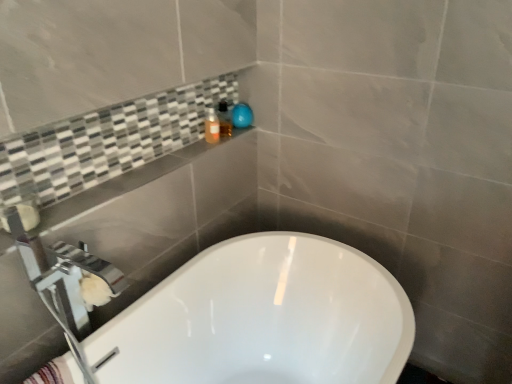
Where is `silver metallic faucet at lower left`? silver metallic faucet at lower left is located at coordinates (76, 283).

Describe the element at coordinates (64, 283) in the screenshot. The image size is (512, 384). I see `chrome metallic tap at upper left` at that location.

You are a GUI agent. You are given a task and a screenshot of the screen. Output one action in this format:
    pyautogui.click(x=<x>, y=<y>)
    Task: Click on the matte orange bottle at upper center, which is counted as the 2th toiletry, starting from the right
    The image size is (512, 384).
    Given the screenshot: What is the action you would take?
    pyautogui.click(x=212, y=126)

What do you see at coordinates (224, 119) in the screenshot?
I see `translucent plastic soap dispenser at upper center, the first toiletry positioned from the right` at bounding box center [224, 119].

Image resolution: width=512 pixels, height=384 pixels. Identify the location of striped cotton bath towel at lower left. (52, 373).

From a real-world perspective, which is physically below, chrome metallic tap at upper left or silver metallic faucet at lower left?

chrome metallic tap at upper left, from a real-world perspective.

Is chrome metallic tap at upper left facing away from silver metallic faucet at lower left?

No, chrome metallic tap at upper left is not facing away from silver metallic faucet at lower left.

Where is `bath towel that appears below the matte orange bottle at upper center, which is counted as the 2th toiletry, starting from the right (from a real-world perspective)`? bath towel that appears below the matte orange bottle at upper center, which is counted as the 2th toiletry, starting from the right (from a real-world perspective) is located at coordinates (52, 373).

Are matte orange bottle at upper center, which is counted as the 2th toiletry, starting from the right, and striped cotton bath towel at lower left located far from each other?

No, matte orange bottle at upper center, which is counted as the 2th toiletry, starting from the right, is not far from striped cotton bath towel at lower left.

Between matte orange bottle at upper center, which is counted as the 2th toiletry, starting from the right, and striped cotton bath towel at lower left, which one appears on the right side from the viewer's perspective?

Positioned to the right is matte orange bottle at upper center, which is counted as the 2th toiletry, starting from the right.

Considering the points (79, 287) and (48, 368), which point is in front, point (79, 287) or point (48, 368)?

Positioned in front is point (79, 287).

From the image's perspective, which object appears higher, chrome metallic tap at upper left or striped cotton bath towel at lower left?

chrome metallic tap at upper left.

Considering the relative positions of chrome metallic tap at upper left and striped cotton bath towel at lower left in the image provided, is chrome metallic tap at upper left behind striped cotton bath towel at lower left?

No.

How different are the orientations of chrome metallic tap at upper left and striped cotton bath towel at lower left in degrees?

0.00513 degrees.

Which is less distant, (97, 266) or (72, 330)?

The point (72, 330) is closer to the camera.

Is silver metallic faucet at lower left taller or shorter than chrome metallic tap at upper left?

In the image, silver metallic faucet at lower left appears to be shorter than chrome metallic tap at upper left.

Which is correct: silver metallic faucet at lower left is inside chrome metallic tap at upper left, or outside of it?

silver metallic faucet at lower left is spatially positioned inside chrome metallic tap at upper left.

From a real-world perspective, which is physically above, translucent plastic soap dispenser at upper center, the first toiletry positioned from the right, or white glossy bathtub at center?

In real-world perspective, translucent plastic soap dispenser at upper center, the first toiletry positioned from the right, is above.

In the scene shown: Is translucent plastic soap dispenser at upper center, marked as the second toiletry in a left-to-right arrangement, oriented away from white glossy bathtub at center?

translucent plastic soap dispenser at upper center, marked as the second toiletry in a left-to-right arrangement, does not have its back to white glossy bathtub at center.

Which is closer to the camera, [227,109] or [143,336]?

Point [143,336]

Does translucent plastic soap dispenser at upper center, marked as the second toiletry in a left-to-right arrangement, lie behind white glossy bathtub at center?

Yes, translucent plastic soap dispenser at upper center, marked as the second toiletry in a left-to-right arrangement, is behind white glossy bathtub at center.

Which object is closer to the camera, translucent plastic soap dispenser at upper center, the first toiletry positioned from the right, or chrome metallic tap at upper left?

chrome metallic tap at upper left is closer to the camera.

In terms of height, does translucent plastic soap dispenser at upper center, marked as the second toiletry in a left-to-right arrangement, look taller or shorter compared to chrome metallic tap at upper left?

In the image, translucent plastic soap dispenser at upper center, marked as the second toiletry in a left-to-right arrangement, appears to be shorter than chrome metallic tap at upper left.

Which is in front, point (223, 125) or point (97, 265)?

The point (97, 265) is closer.

From a real-world perspective, is translucent plastic soap dispenser at upper center, marked as the second toiletry in a left-to-right arrangement, below chrome metallic tap at upper left?

Incorrect, from a real-world perspective, translucent plastic soap dispenser at upper center, marked as the second toiletry in a left-to-right arrangement, is higher than chrome metallic tap at upper left.

Is translucent plastic soap dispenser at upper center, the first toiletry positioned from the right, to the right of striped cotton bath towel at lower left from the viewer's perspective?

Indeed, translucent plastic soap dispenser at upper center, the first toiletry positioned from the right, is positioned on the right side of striped cotton bath towel at lower left.

Is translucent plastic soap dispenser at upper center, the first toiletry positioned from the right, shorter than striped cotton bath towel at lower left?

Yes, translucent plastic soap dispenser at upper center, the first toiletry positioned from the right, is shorter than striped cotton bath towel at lower left.

From a real-world perspective, who is located higher, translucent plastic soap dispenser at upper center, marked as the second toiletry in a left-to-right arrangement, or striped cotton bath towel at lower left?

translucent plastic soap dispenser at upper center, marked as the second toiletry in a left-to-right arrangement.

Looking at this image, does translucent plastic soap dispenser at upper center, the first toiletry positioned from the right, turn towards striped cotton bath towel at lower left?

No, translucent plastic soap dispenser at upper center, the first toiletry positioned from the right, is not facing towards striped cotton bath towel at lower left.

Image resolution: width=512 pixels, height=384 pixels. I want to click on tap lying on the right of silver metallic faucet at lower left, so click(x=64, y=283).

From a real-world perspective, count 1st toiletrys upward from the striped cotton bath towel at lower left and point to it. Please provide its 2D coordinates.

[(212, 126)]

Estimate the real-world distances between objects in this image. Which object is closer to white glossy bathtub at center, silver metallic faucet at lower left or translucent plastic soap dispenser at upper center, the first toiletry positioned from the right?

silver metallic faucet at lower left lies closer to white glossy bathtub at center than the other object.

Considering their positions, is chrome metallic tap at upper left positioned closer to matte orange bottle at upper center, which is counted as the 2th toiletry, starting from the right, than striped cotton bath towel at lower left?

chrome metallic tap at upper left is positioned closer to the anchor matte orange bottle at upper center, which is counted as the 2th toiletry, starting from the right.

Looking at this image, based on their spatial positions, is chrome metallic tap at upper left or translucent plastic soap dispenser at upper center, marked as the second toiletry in a left-to-right arrangement, closer to striped cotton bath towel at lower left?

chrome metallic tap at upper left lies closer to striped cotton bath towel at lower left than the other object.

Estimate the real-world distances between objects in this image. Which object is further from striped cotton bath towel at lower left, silver metallic faucet at lower left or translucent plastic soap dispenser at upper center, marked as the second toiletry in a left-to-right arrangement?

translucent plastic soap dispenser at upper center, marked as the second toiletry in a left-to-right arrangement, is further to striped cotton bath towel at lower left.

From the image, which object appears to be nearer to chrome metallic tap at upper left, translucent plastic soap dispenser at upper center, the first toiletry positioned from the right, or striped cotton bath towel at lower left?

The object closer to chrome metallic tap at upper left is striped cotton bath towel at lower left.

Which object lies nearer to the anchor point white glossy bathtub at center, striped cotton bath towel at lower left or silver metallic faucet at lower left?

silver metallic faucet at lower left lies closer to white glossy bathtub at center than the other object.

Estimate the real-world distances between objects in this image. Which object is closer to silver metallic faucet at lower left, chrome metallic tap at upper left or white glossy bathtub at center?

chrome metallic tap at upper left.

Looking at the image, which one is located closer to striped cotton bath towel at lower left, chrome metallic tap at upper left or matte orange bottle at upper center, which ranks as the first toiletry in left-to-right order?

chrome metallic tap at upper left lies closer to striped cotton bath towel at lower left than the other object.

Identify the location of toiletry located between white glossy bathtub at center and translucent plastic soap dispenser at upper center, the first toiletry positioned from the right, in the depth direction. (212, 126).

This screenshot has width=512, height=384. I want to click on faucet between translucent plastic soap dispenser at upper center, the first toiletry positioned from the right, and striped cotton bath towel at lower left in the up-down direction, so click(76, 283).

What are the coordinates of `tap that lies between matte orange bottle at upper center, which ranks as the first toiletry in left-to-right order, and striped cotton bath towel at lower left from top to bottom` in the screenshot? It's located at (64, 283).

The height and width of the screenshot is (384, 512). What are the coordinates of `tap between white glossy bathtub at center and matte orange bottle at upper center, which is counted as the 2th toiletry, starting from the right, along the z-axis` in the screenshot? It's located at [64, 283].